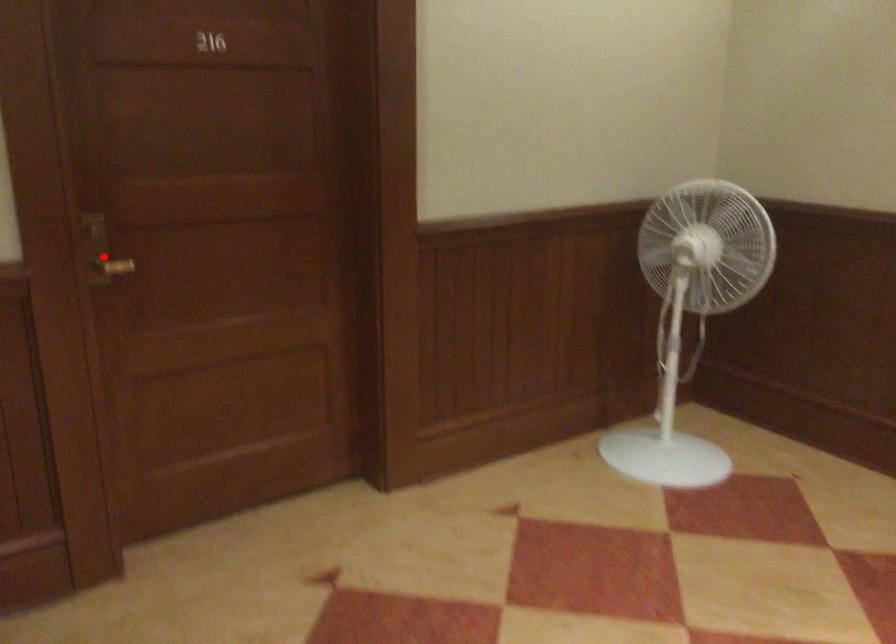
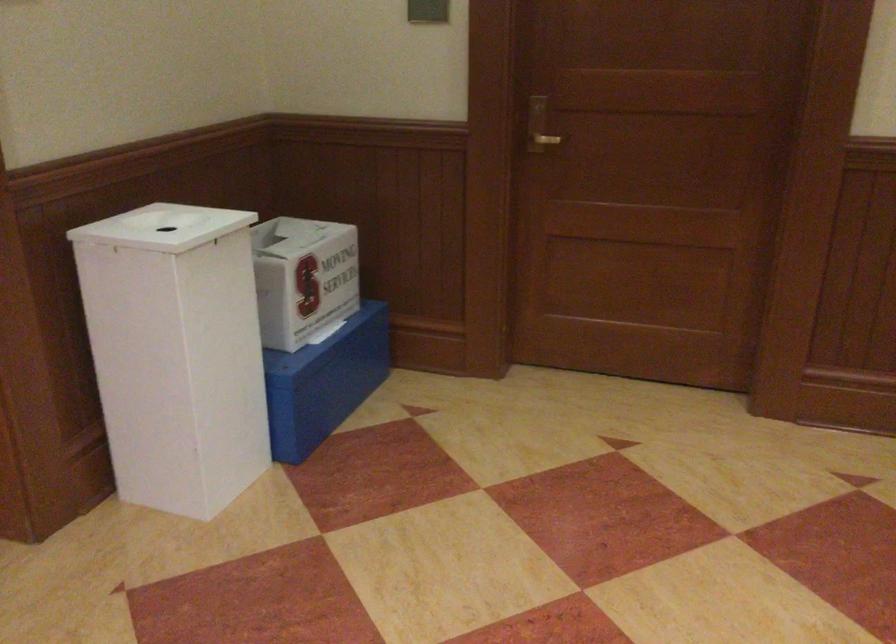
Find the pixel in the second image that matches the highlighted location in the first image.

(538, 126)